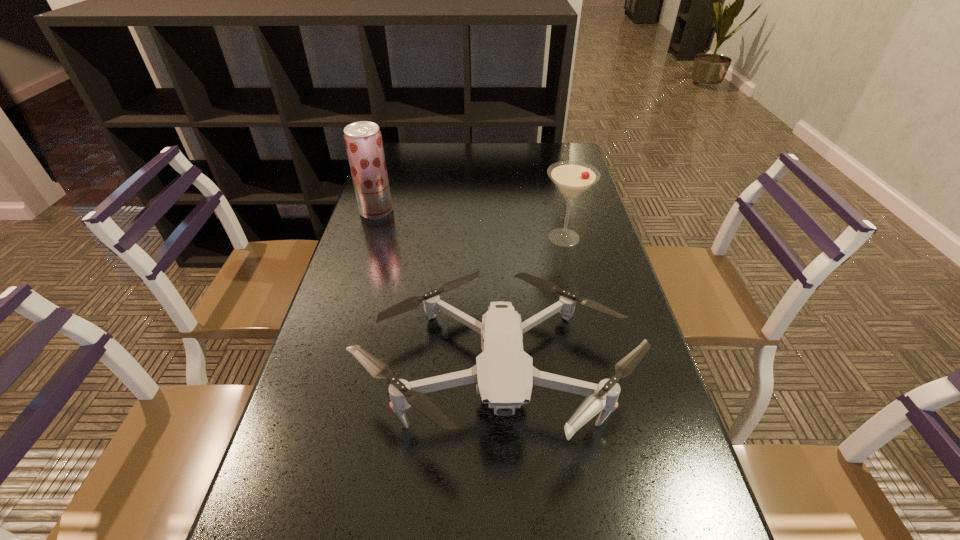
Where is `the leftmost object`? The width and height of the screenshot is (960, 540). the leftmost object is located at coordinates (363, 140).

Image resolution: width=960 pixels, height=540 pixels. I want to click on the tallest object, so click(363, 140).

You are a GUI agent. You are given a task and a screenshot of the screen. Output one action in this format:
    pyautogui.click(x=<x>, y=<y>)
    Task: Click on the second shortest object
    Image resolution: width=960 pixels, height=540 pixels.
    Given the screenshot: What is the action you would take?
    pyautogui.click(x=572, y=178)

Where is `martini`? This screenshot has height=540, width=960. martini is located at coordinates (572, 178).

Image resolution: width=960 pixels, height=540 pixels. What are the coordinates of `the nearest object` in the screenshot? It's located at [504, 373].

Locate an element on the screen. Image resolution: width=960 pixels, height=540 pixels. the shortest object is located at coordinates (504, 373).

Where is `blank area located 0.370m on the back of the tallest object`? blank area located 0.370m on the back of the tallest object is located at coordinates (396, 151).

Where is `blank space located on the front of the martini`? The height and width of the screenshot is (540, 960). blank space located on the front of the martini is located at coordinates (589, 348).

Identify the location of vacant space located with a camera at the front of the shortest object. Image resolution: width=960 pixels, height=540 pixels. pyautogui.click(x=501, y=533).

Where is `fruit juice at the left edge`? fruit juice at the left edge is located at coordinates (363, 140).